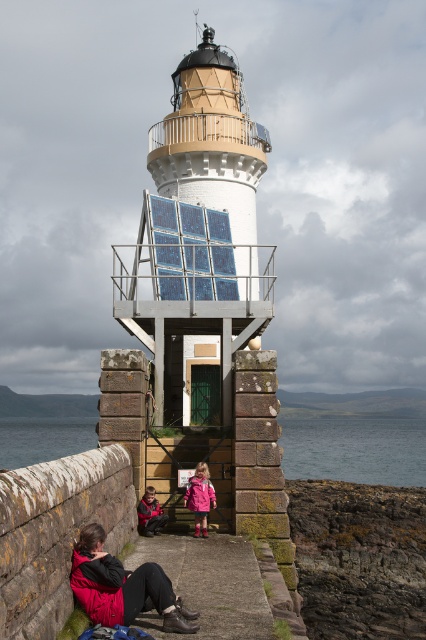
Looking at this image, is blue water at lower center below pink matte jacket at lower center?

Yes, blue water at lower center is below pink matte jacket at lower center.

The width and height of the screenshot is (426, 640). I want to click on blue water at lower center, so click(x=356, y=449).

Which is behind, point (43, 436) or point (192, 497)?

Positioned behind is point (43, 436).

Locate an element on the screen. This screenshot has height=640, width=426. blue water at lower center is located at coordinates (356, 449).

Can you confirm if matte pink jacket at lower left is thinner than pink matte jacket at lower center?

Incorrect, matte pink jacket at lower left's width is not less than pink matte jacket at lower center's.

Where is `matte pink jacket at lower left`? This screenshot has height=640, width=426. matte pink jacket at lower left is located at coordinates (123, 586).

Image resolution: width=426 pixels, height=640 pixels. In order to click on matte pink jacket at lower left in this screenshot , I will do `click(123, 586)`.

What are the coordinates of `matte pink jacket at lower left` in the screenshot? It's located at (123, 586).

Does pink matte jacket at lower center lie behind matte black jacket at lower left?

That is True.

Is pink matte jacket at lower center wider than matte black jacket at lower left?

Yes, pink matte jacket at lower center is wider than matte black jacket at lower left.

Measure the distance between point (184, 502) and camera.

The distance of point (184, 502) from camera is 36.07 meters.

Locate an element on the screen. The image size is (426, 640). pink matte jacket at lower center is located at coordinates (199, 497).